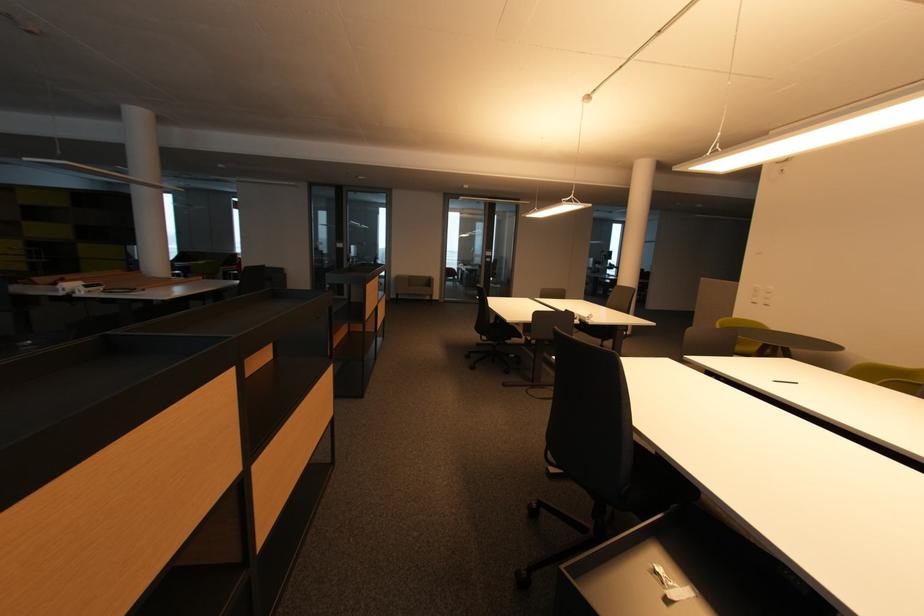
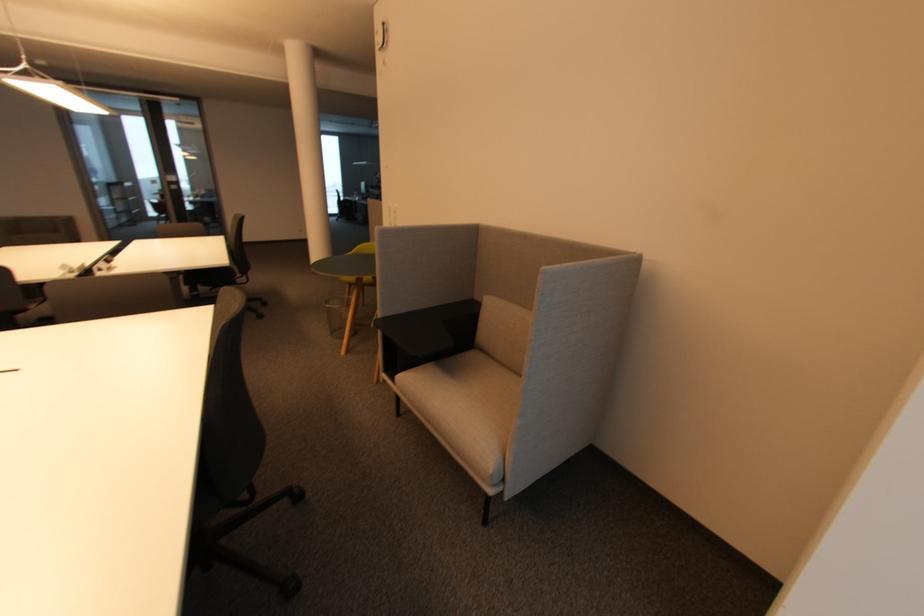
Question: In a continuous first-person perspective shot, in which direction is the camera moving?

Choices:
 (A) Left
 (B) Right
 (C) Forward
 (D) Backward

Answer: (B)